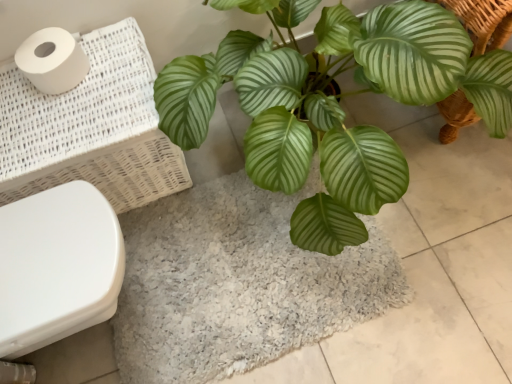
Where is `empty space that is ontop of white glossy toilet bowl at lower left (from a real-world perspective)`? The width and height of the screenshot is (512, 384). empty space that is ontop of white glossy toilet bowl at lower left (from a real-world perspective) is located at coordinates (45, 251).